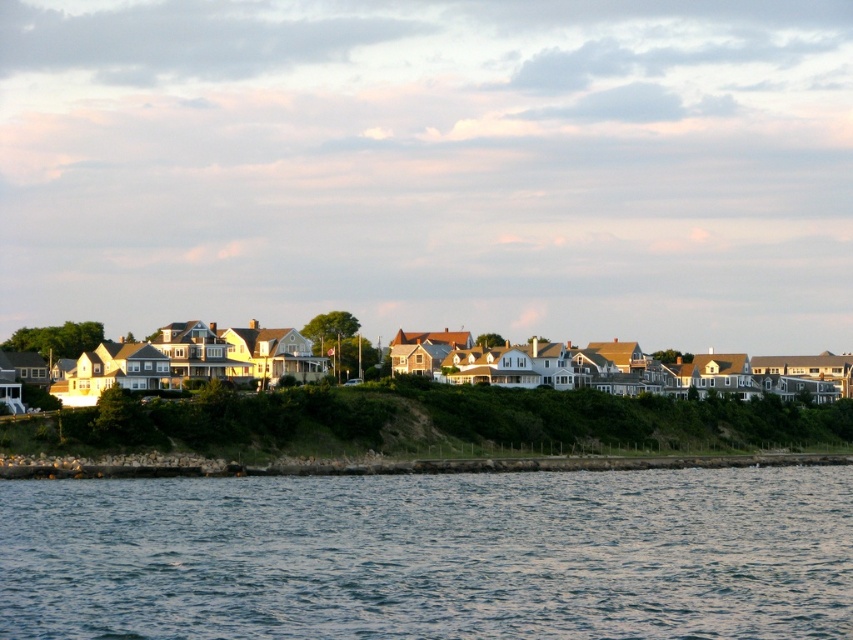
You are standing at the edge of the water in this coastal scene. You see two points marked in the image. Which point, point (514, 628) or point (699, 429), is closer to you?

Point (514, 628) is closer to the viewer than point (699, 429).